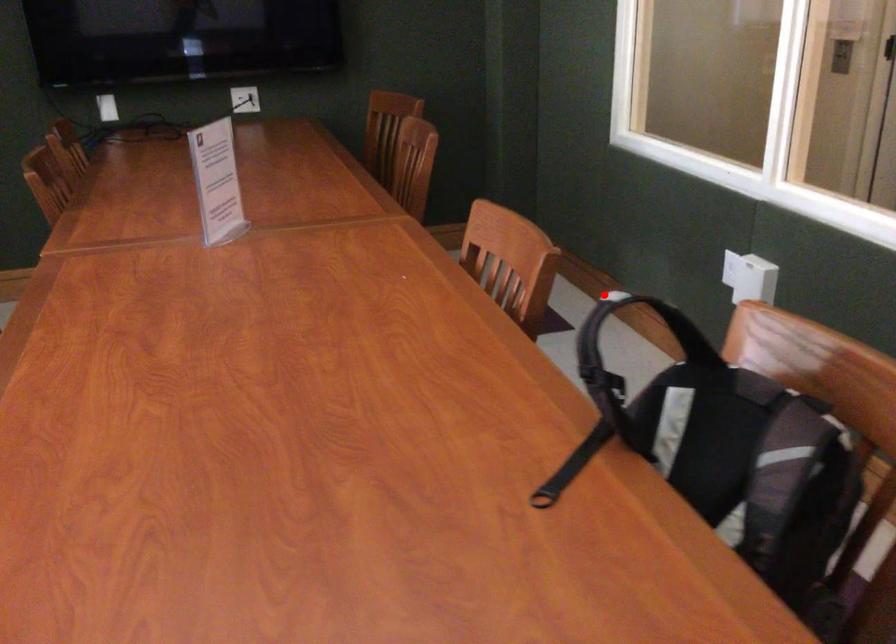
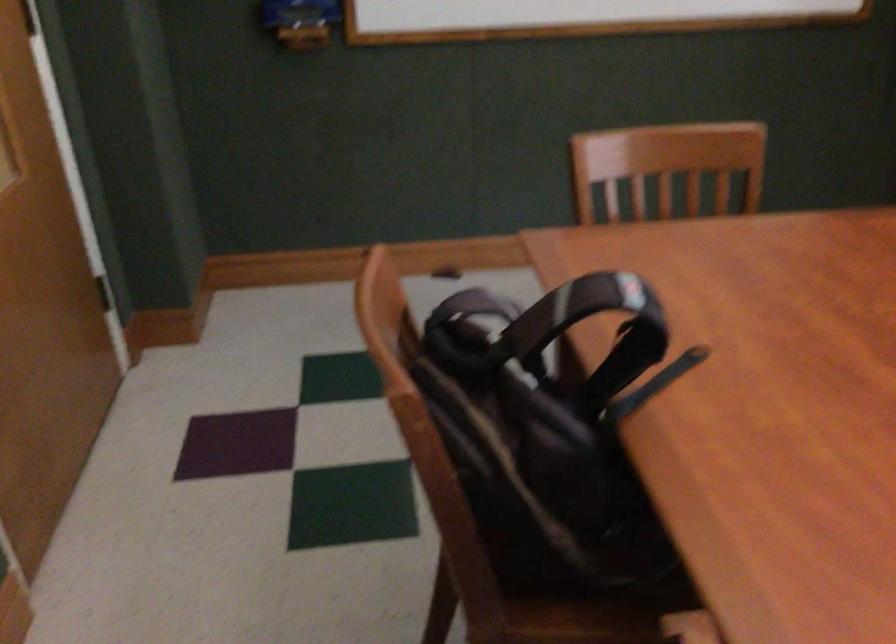
Locate, in the second image, the point that corresponds to the highlighted location in the first image.

(625, 297)